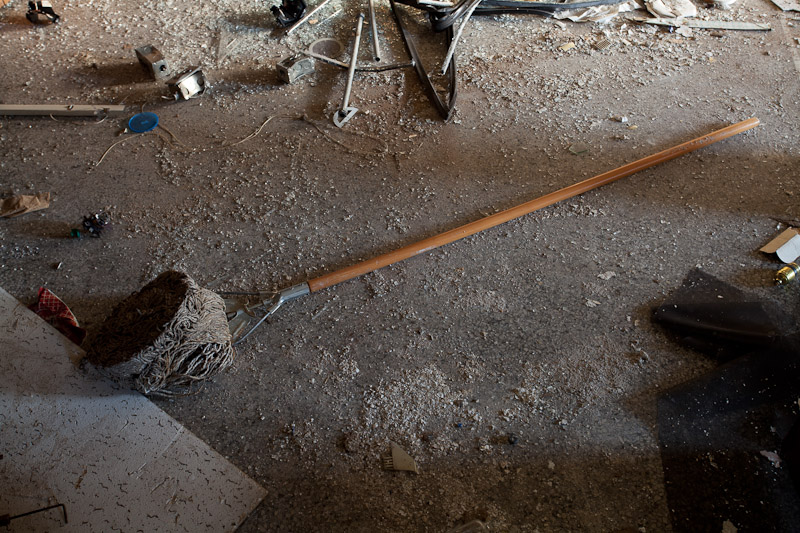
This screenshot has height=533, width=800. What are the coordinates of `piece of drop ceiling` in the screenshot? It's located at (144, 488).